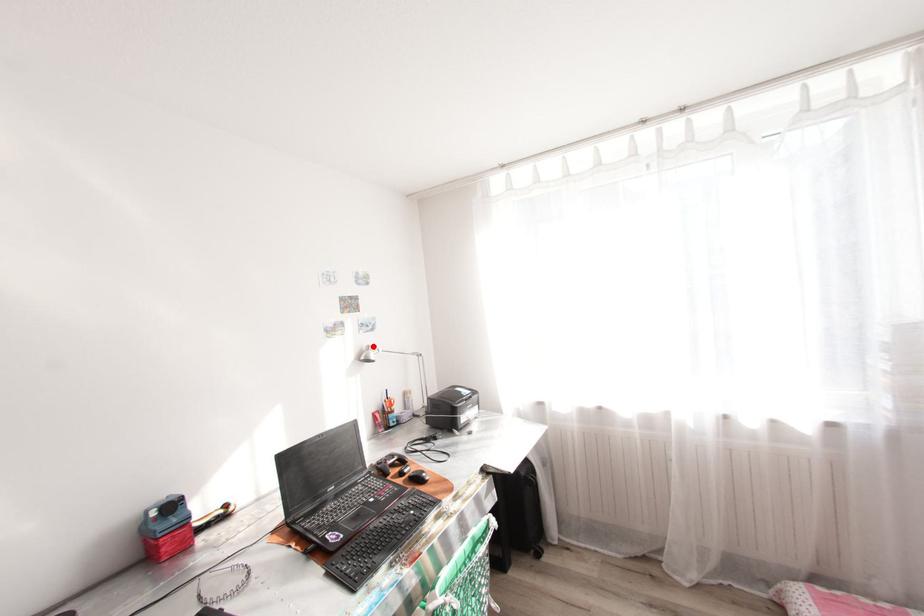
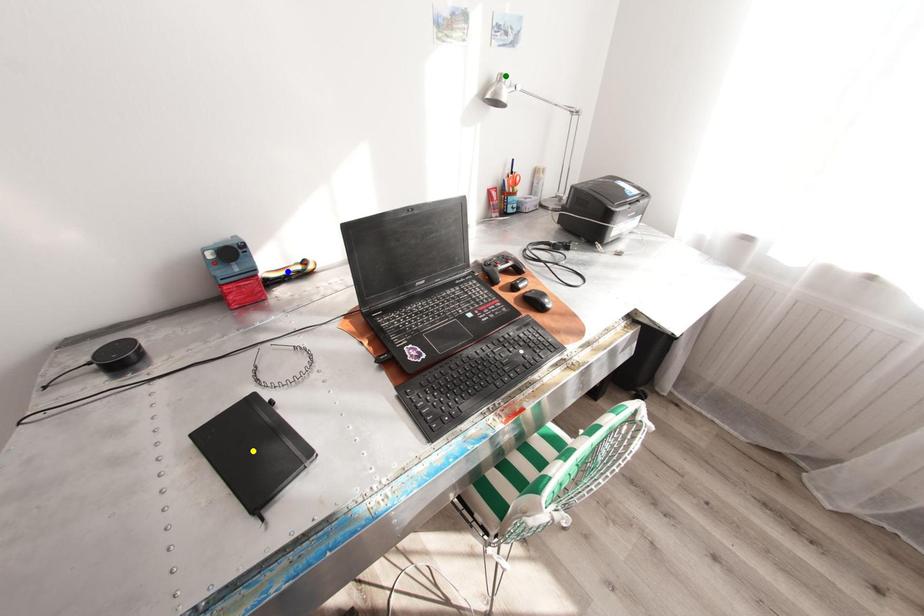
Question: I am providing you with two images of the same scene from different viewpoints. A red point is marked on the first image. You are given multiple points on the second image. Which point in image 2 represents the same 3d spot as the red point in image 1?

Choices:
 (A) blue point
 (B) yellow point
 (C) green point

Answer: (C)